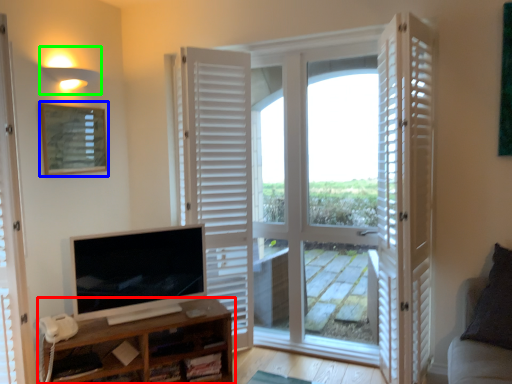
Question: Estimate the real-world distances between objects in this image. Which object is closer to shelf (highlighted by a red box), picture frame (highlighted by a blue box) or light fixture (highlighted by a green box)?

Choices:
 (A) picture frame
 (B) light fixture

Answer: (A)